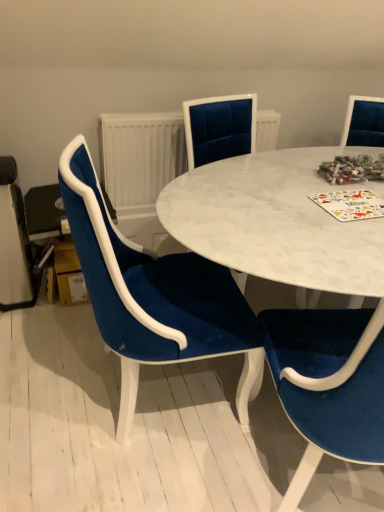
Question: Is white marble table at center at the right side of velvet blue chair at center, marked as the 2th chair in a left-to-right arrangement?

Choices:
 (A) yes
 (B) no

Answer: (B)

Question: Considering the relative sizes of white marble table at center and velvet blue chair at center, which is the 1th chair in right-to-left order, in the image provided, is white marble table at center smaller than velvet blue chair at center, which is the 1th chair in right-to-left order,?

Choices:
 (A) yes
 (B) no

Answer: (A)

Question: Does white marble table at center have a lesser width compared to velvet blue chair at center, marked as the 2th chair in a left-to-right arrangement?

Choices:
 (A) no
 (B) yes

Answer: (B)

Question: Is white marble table at center at the left side of velvet blue chair at center, marked as the 2th chair in a left-to-right arrangement?

Choices:
 (A) yes
 (B) no

Answer: (A)

Question: Could you tell me if white marble table at center is turned towards velvet blue chair at center, marked as the 2th chair in a left-to-right arrangement?

Choices:
 (A) yes
 (B) no

Answer: (A)

Question: Considering the relative sizes of white marble table at center and velvet blue chair at center, marked as the 2th chair in a left-to-right arrangement, in the image provided, is white marble table at center wider than velvet blue chair at center, marked as the 2th chair in a left-to-right arrangement,?

Choices:
 (A) no
 (B) yes

Answer: (A)

Question: Is white marble table at center oriented towards multicolored paper at center?

Choices:
 (A) no
 (B) yes

Answer: (B)

Question: From the image's perspective, is white marble table at center beneath multicolored paper at center?

Choices:
 (A) no
 (B) yes

Answer: (A)

Question: From a real-world perspective, is white marble table at center physically above multicolored paper at center?

Choices:
 (A) yes
 (B) no

Answer: (B)

Question: From the image's perspective, is white marble table at center above multicolored paper at center?

Choices:
 (A) no
 (B) yes

Answer: (B)

Question: Is white marble table at center to the left of multicolored paper at center from the viewer's perspective?

Choices:
 (A) no
 (B) yes

Answer: (B)

Question: Is white marble table at center not near multicolored paper at center?

Choices:
 (A) yes
 (B) no

Answer: (B)

Question: Is multicolored paper at center completely or partially inside velvet blue chair at left, which is the first chair in left-to-right order?

Choices:
 (A) yes
 (B) no

Answer: (B)